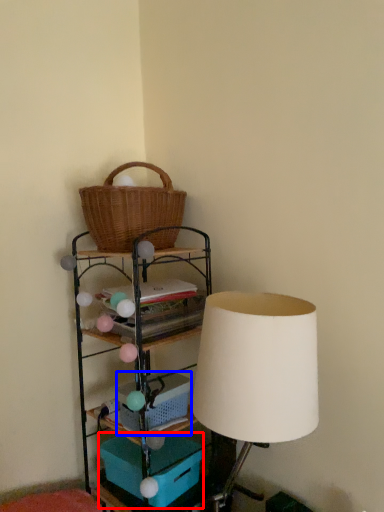
Question: Among these objects, which one is nearest to the camera, storage box (highlighted by a red box) or basket (highlighted by a blue box)?

Choices:
 (A) storage box
 (B) basket

Answer: (A)